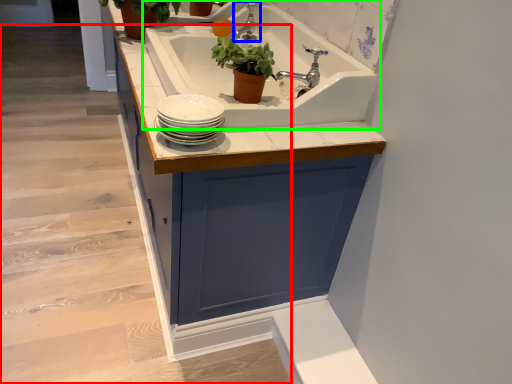
Question: Based on their relative distances, which object is nearer to stairwell (highlighted by a red box)? Choose from tap (highlighted by a blue box) and sink (highlighted by a green box).

Choices:
 (A) tap
 (B) sink

Answer: (B)